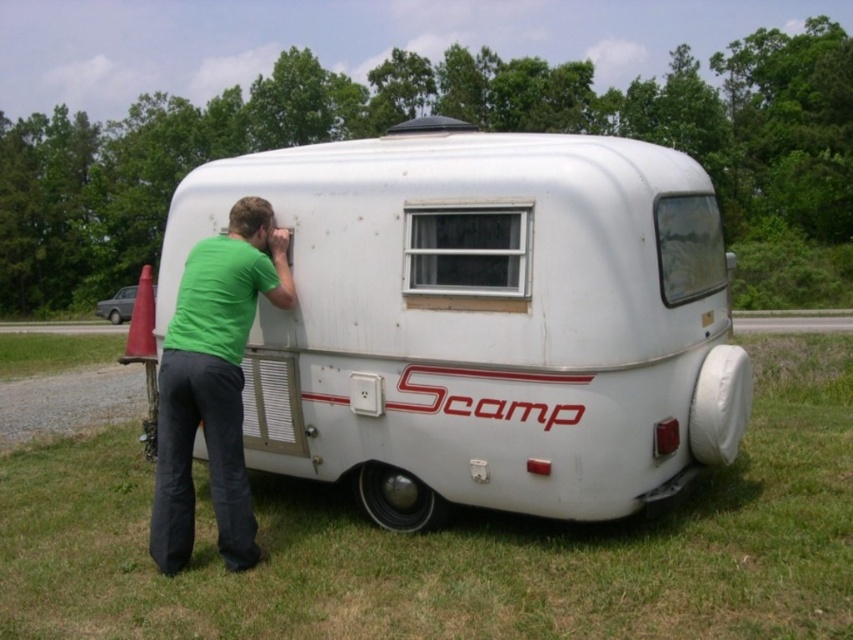
Is green grass at lower center shorter than white matte trailer at lower left?

Yes.

Does green grass at lower center have a greater width compared to white matte trailer at lower left?

No.

Where is `green grass at lower center`? green grass at lower center is located at coordinates (457, 545).

Can you confirm if white matte recreational vehicle at center is thinner than green matte shirt at lower left?

Incorrect, white matte recreational vehicle at center's width is not less than green matte shirt at lower left's.

Looking at this image, which of these two, white matte recreational vehicle at center or green matte shirt at lower left, stands shorter?

Standing shorter between the two is green matte shirt at lower left.

Find the location of a particular element. white matte recreational vehicle at center is located at coordinates (483, 321).

Is white matte recreational vehicle at center closer to camera compared to white matte trailer at lower left?

Yes.

In the scene shown: Is white matte recreational vehicle at center to the left of white matte trailer at lower left from the viewer's perspective?

Incorrect, white matte recreational vehicle at center is not on the left side of white matte trailer at lower left.

What do you see at coordinates (483, 321) in the screenshot? I see `white matte recreational vehicle at center` at bounding box center [483, 321].

Locate an element on the screen. This screenshot has width=853, height=640. white matte recreational vehicle at center is located at coordinates (483, 321).